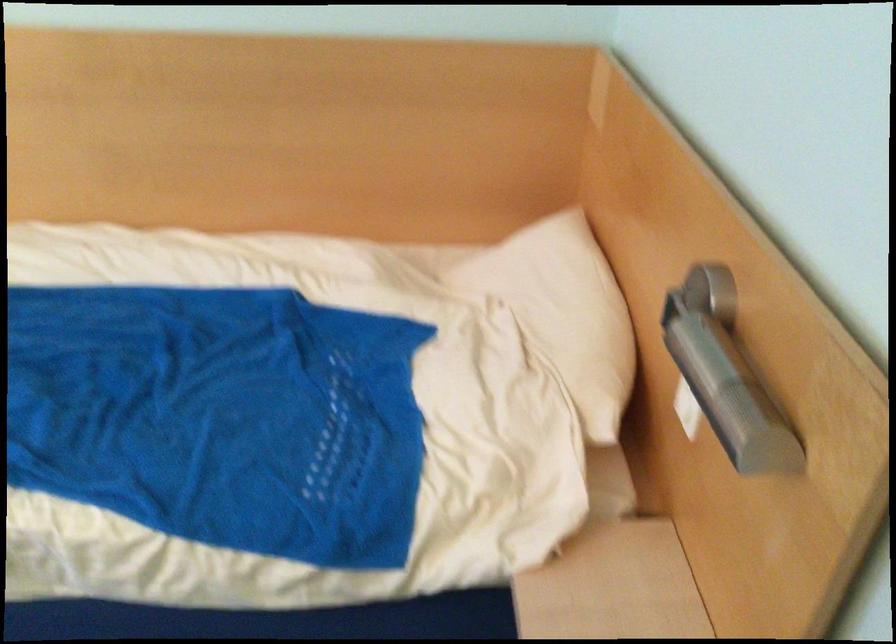
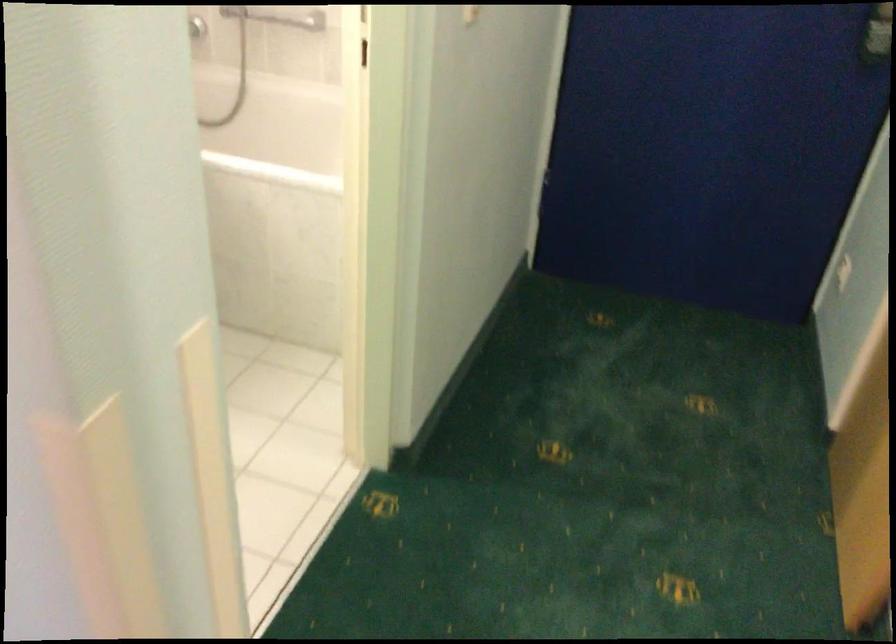
The images are taken continuously from a first-person perspective. In which direction is your viewpoint rotating?

The camera rotated toward right-down.